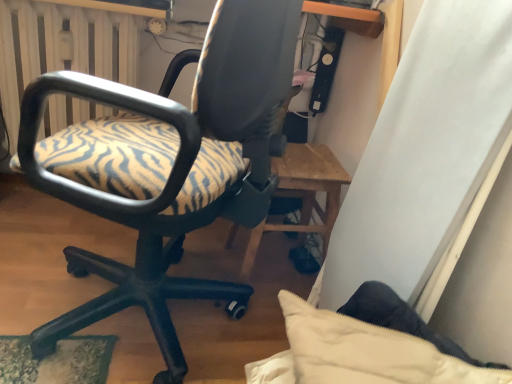
The width and height of the screenshot is (512, 384). In order to click on free space below zebra-patterned fabric office chair at left (from a real-world perspective) in this screenshot , I will do `click(119, 323)`.